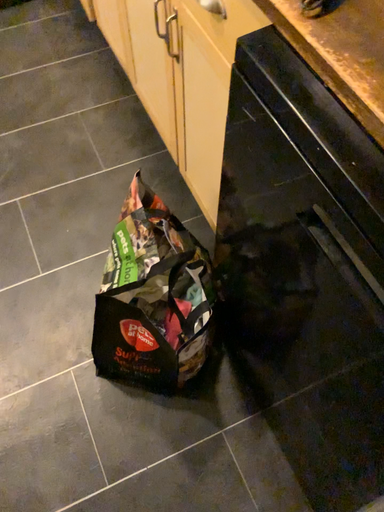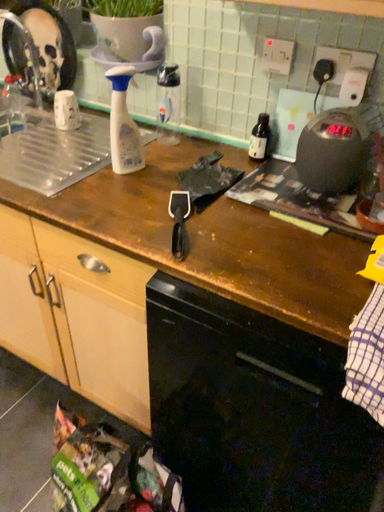
Question: Which way did the camera rotate in the video?

Choices:
 (A) rotated left
 (B) rotated right

Answer: (B)